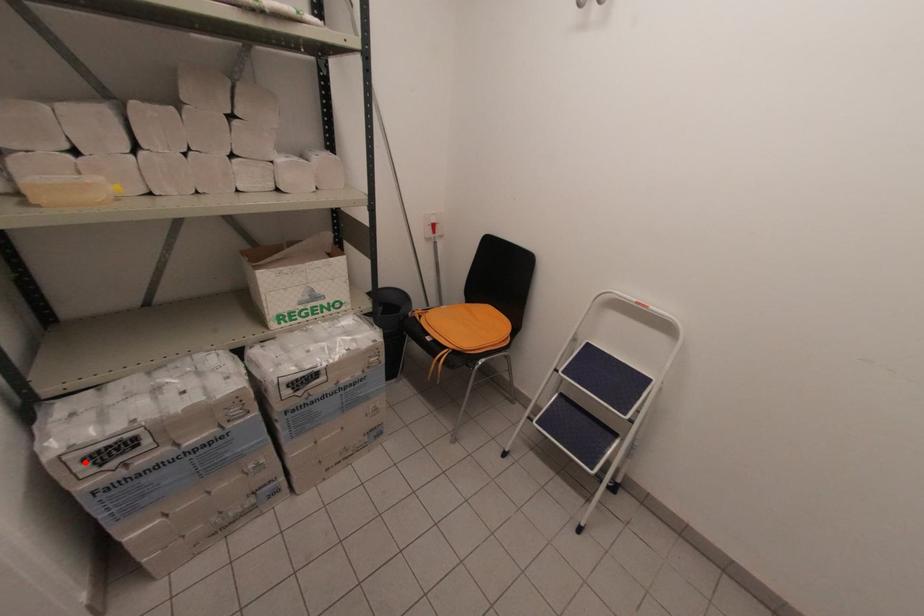
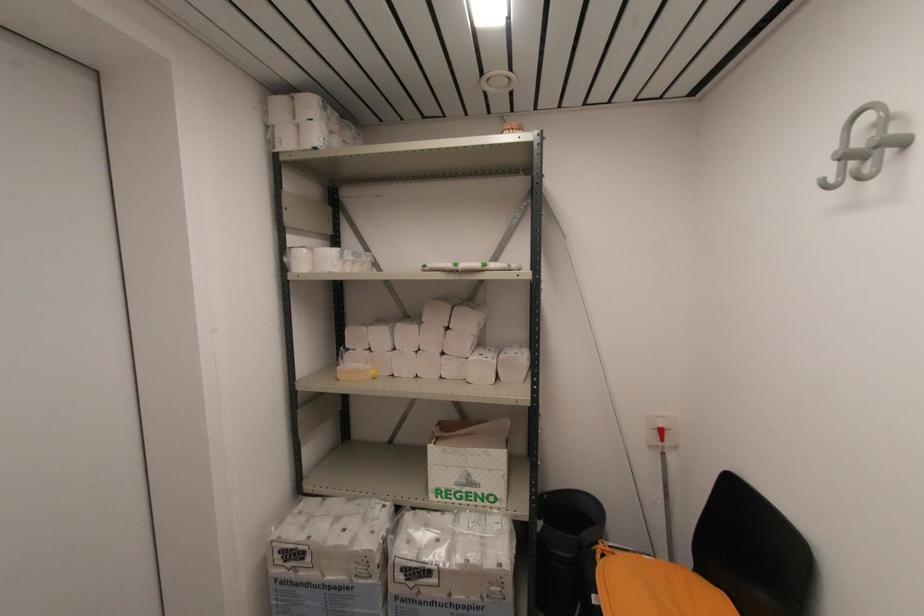
In the second image, find the point that corresponds to the highlighted location in the first image.

(281, 553)